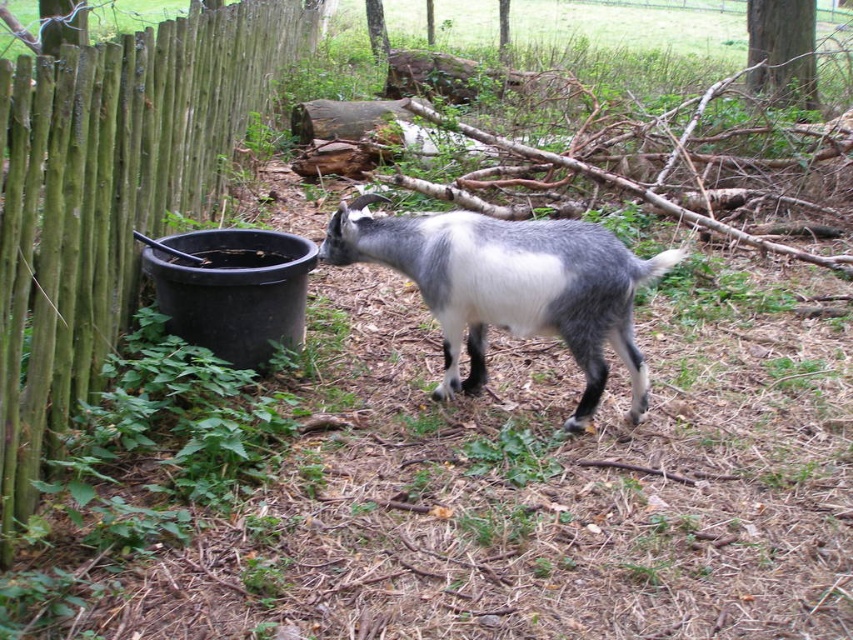
You are a farmer checking the fence. You see the green wood fence at left and the gray woolen goat at center. Which one has a smaller width?

The green wood fence at left is thinner than the gray woolen goat at center, so the green wood fence at left has a smaller width.

You are a farmer who needs to check the fence. You are currently standing next to the gray woolen goat at center. Which direction should you walk to reach the green wood fence at left?

The green wood fence at left is to the left of gray woolen goat at center, so you should walk to the left to reach the green wood fence at left.